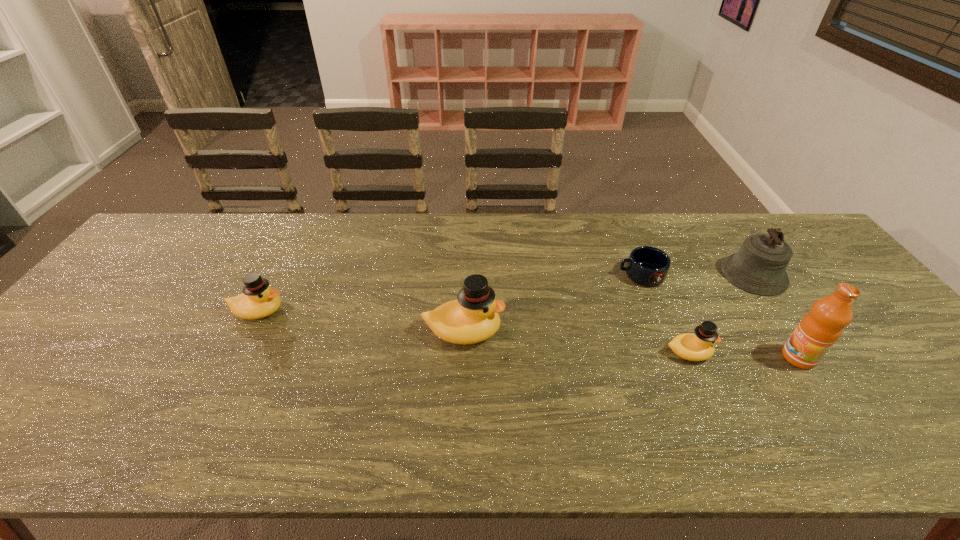
Image resolution: width=960 pixels, height=540 pixels. Identify the location of vacant space at the far edge. (541, 253).

In the image, there is a desktop. Where is `free region at the near edge`? Image resolution: width=960 pixels, height=540 pixels. free region at the near edge is located at coordinates (758, 401).

This screenshot has width=960, height=540. Find the location of `free space at the left edge of the desktop`. free space at the left edge of the desktop is located at coordinates (149, 270).

The height and width of the screenshot is (540, 960). What are the coordinates of `blank space at the far left corner` in the screenshot? It's located at (159, 233).

Locate an element on the screen. Image resolution: width=960 pixels, height=540 pixels. vacant space at the far right corner of the desktop is located at coordinates (800, 234).

Locate an element on the screen. The width and height of the screenshot is (960, 540). free space between the second shortest duck and the shortest object is located at coordinates (449, 293).

Find the location of a particular element. The image size is (960, 540). free point between the shortest object and the tallest duck is located at coordinates (552, 303).

You are a GUI agent. You are given a task and a screenshot of the screen. Output one action in this format:
    pyautogui.click(x=<x>, y=<y>)
    Task: Click on the vacant point located between the second tallest duck and the mug
    
    Given the screenshot: What is the action you would take?
    pyautogui.click(x=449, y=293)

Image resolution: width=960 pixels, height=540 pixels. Identify the location of free space between the third shortest object and the tallest object. (528, 334).

What are the coordinates of `free spot between the bell and the fruit juice` in the screenshot? It's located at (777, 316).